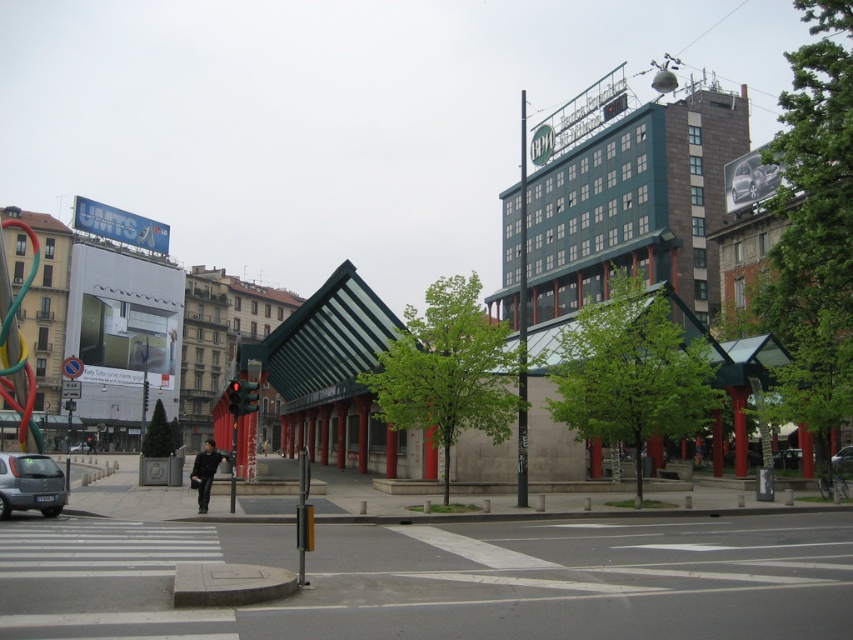
Question: Where is white asphalt at center located in relation to silver metallic car at lower left in the image?

Choices:
 (A) right
 (B) left

Answer: (A)

Question: Which point is farther to the camera?

Choices:
 (A) (813, 620)
 (B) (22, 468)

Answer: (B)

Question: Is white asphalt at center wider than silver metallic car at lower left?

Choices:
 (A) no
 (B) yes

Answer: (B)

Question: Which point appears closest to the camera in this image?

Choices:
 (A) (7, 600)
 (B) (9, 488)

Answer: (A)

Question: Is white asphalt at center below silver metallic car at lower left?

Choices:
 (A) yes
 (B) no

Answer: (A)

Question: Which of the following is the farthest from the observer?

Choices:
 (A) (39, 508)
 (B) (419, 568)

Answer: (A)